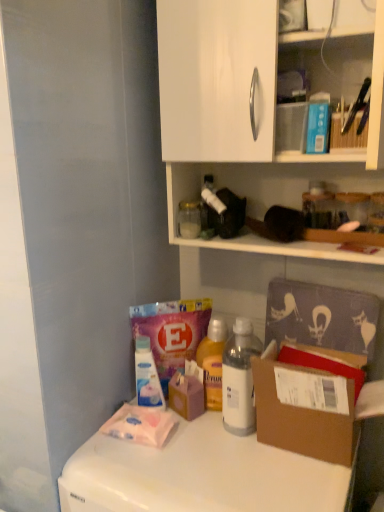
You are a GUI agent. You are given a task and a screenshot of the screen. Output one action in this format:
    pyautogui.click(x=<x>, y=<y>)
    Task: Click on the free region on the left part of brown cardboard box at lower right
    Image resolution: width=384 pixels, height=512 pixels.
    Given the screenshot: What is the action you would take?
    pyautogui.click(x=217, y=464)